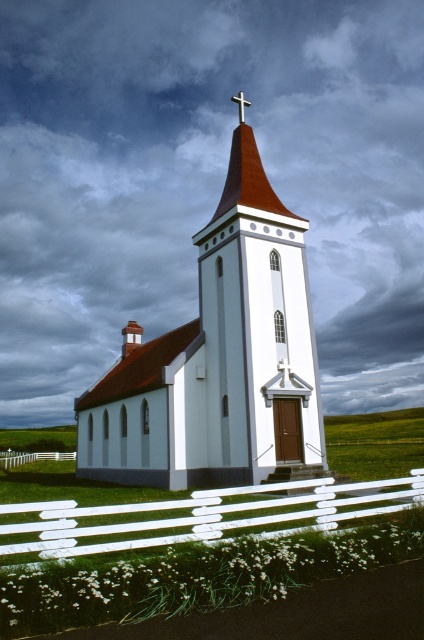
Can you confirm if white wooden fence at lower center is positioned above white wooden fence at lower left?

Yes, white wooden fence at lower center is above white wooden fence at lower left.

Which is above, white wooden fence at lower center or white wooden fence at lower left?

white wooden fence at lower center

Which is behind, point (190, 531) or point (41, 458)?

Positioned behind is point (41, 458).

Where is `white wooden fence at lower center`? white wooden fence at lower center is located at coordinates (200, 515).

Between white smooth church at center and white wooden fence at lower center, which one appears on the left side from the viewer's perspective?

white smooth church at center is more to the left.

Is white smooth church at center to the right of white wooden fence at lower center from the viewer's perspective?

No, white smooth church at center is not to the right of white wooden fence at lower center.

Where is `white smooth church at center`? The image size is (424, 640). white smooth church at center is located at coordinates (219, 360).

Find the location of a particular element. The image size is (424, 640). white smooth church at center is located at coordinates (219, 360).

Is point (2, 458) farther from camera compared to point (242, 109)?

Yes, it is.

Is point (41, 451) positioned before point (242, 93)?

Yes, point (41, 451) is closer to viewer.

This screenshot has height=640, width=424. I want to click on white wooden fence at lower left, so click(33, 458).